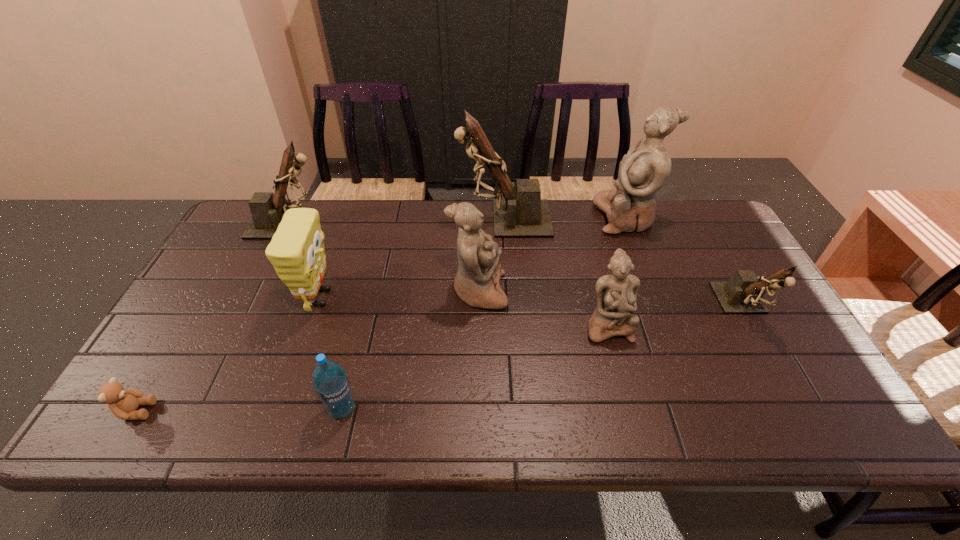
Locate which white figurine is the second closest to the brown teddy bear. Please provide its 2D coordinates. Your answer should be formatted as a tuple, i.e. [(x, y)], where the tuple contains the x and y coordinates of a point satisfying the conditions above.

[(616, 295)]

This screenshot has height=540, width=960. Find the location of `the third closest white figurine to the third object from left to right`. the third closest white figurine to the third object from left to right is located at coordinates point(644,170).

Identify the location of the third closest brown figurine to the smallest white figurine. (267, 209).

You are a GUI agent. You are given a task and a screenshot of the screen. Output one action in this format:
    pyautogui.click(x=<x>, y=<y>)
    Task: Click on the brown figurine identified as the third closest to the sponge
    This screenshot has width=960, height=540.
    Given the screenshot: What is the action you would take?
    pyautogui.click(x=743, y=293)

Where is `free point that satisfies the following two spatial constraints: 1. on the front-facing side of the smallest white figurine; 2. on the face of the brown teddy bear`? This screenshot has width=960, height=540. free point that satisfies the following two spatial constraints: 1. on the front-facing side of the smallest white figurine; 2. on the face of the brown teddy bear is located at coordinates (630, 410).

I want to click on free spot that satisfies the following two spatial constraints: 1. on the front-facing side of the smallest white figurine; 2. on the face of the shortest object, so click(x=630, y=410).